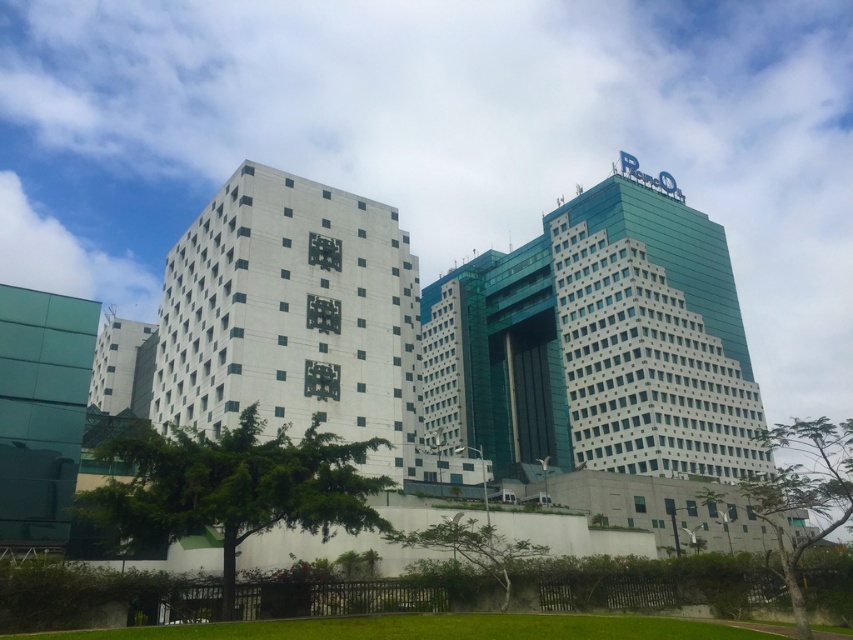
Question: Where is white matte building at center located in relation to green leafy tree at lower center in the image?

Choices:
 (A) right
 (B) left

Answer: (B)

Question: Which object is farther from the camera taking this photo?

Choices:
 (A) green leafy tree at center
 (B) green glass building at center
 (C) green leafy tree at lower center

Answer: (B)

Question: Is green leafy tree at center behind green leafy tree at lower right?

Choices:
 (A) no
 (B) yes

Answer: (A)

Question: Which point appears closest to the camera in this image?

Choices:
 (A) (762, 477)
 (B) (732, 330)

Answer: (A)

Question: Which point appears closest to the camera in this image?

Choices:
 (A) (370, 422)
 (B) (444, 516)
 (C) (163, 516)
 (D) (799, 552)

Answer: (C)

Question: Can you confirm if green glass building at center is positioned to the left of green leafy tree at lower right?

Choices:
 (A) no
 (B) yes

Answer: (B)